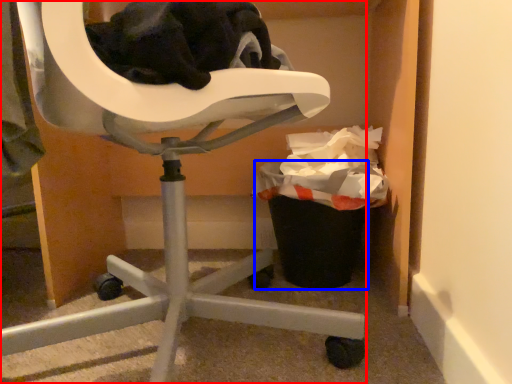
Question: Which of the following is the closest to the observer, chair (highlighted by a red box) or recycling bin (highlighted by a blue box)?

Choices:
 (A) chair
 (B) recycling bin

Answer: (A)